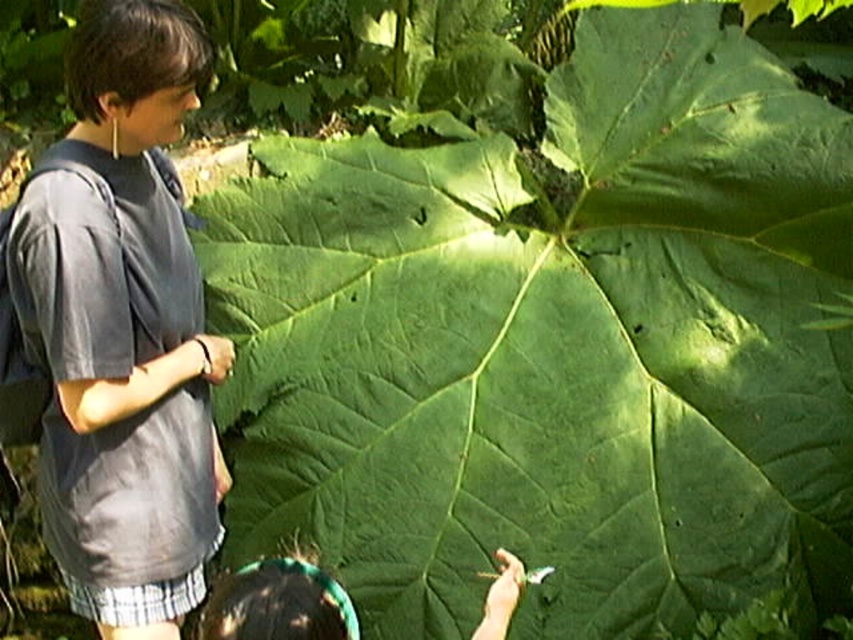
Between gray cotton shirt at left and dark green leaf at lower center, which one has less height?

Standing shorter between the two is dark green leaf at lower center.

Can you confirm if gray cotton shirt at left is positioned to the left of dark green leaf at lower center?

Yes, gray cotton shirt at left is to the left of dark green leaf at lower center.

What are the coordinates of `gray cotton shirt at left` in the screenshot? It's located at (123, 328).